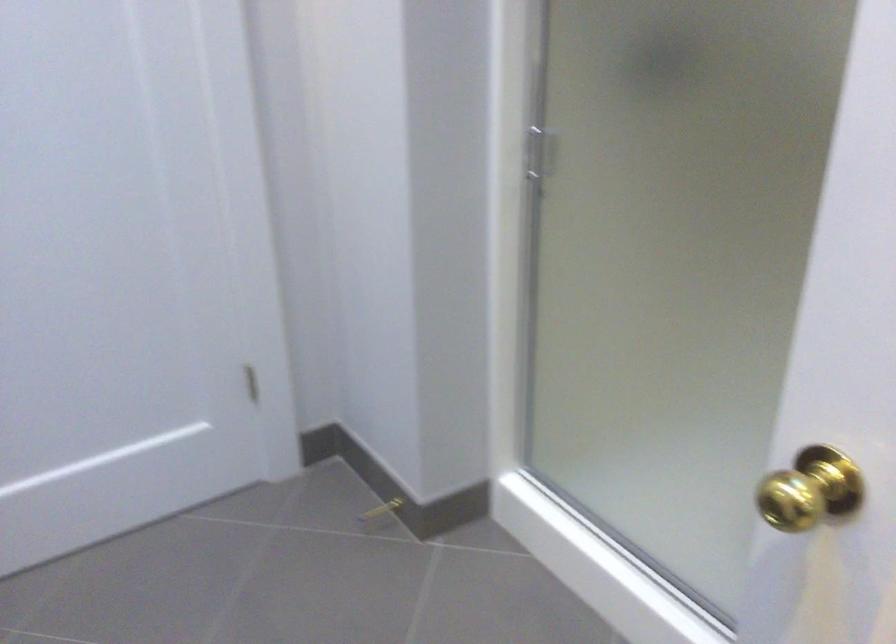
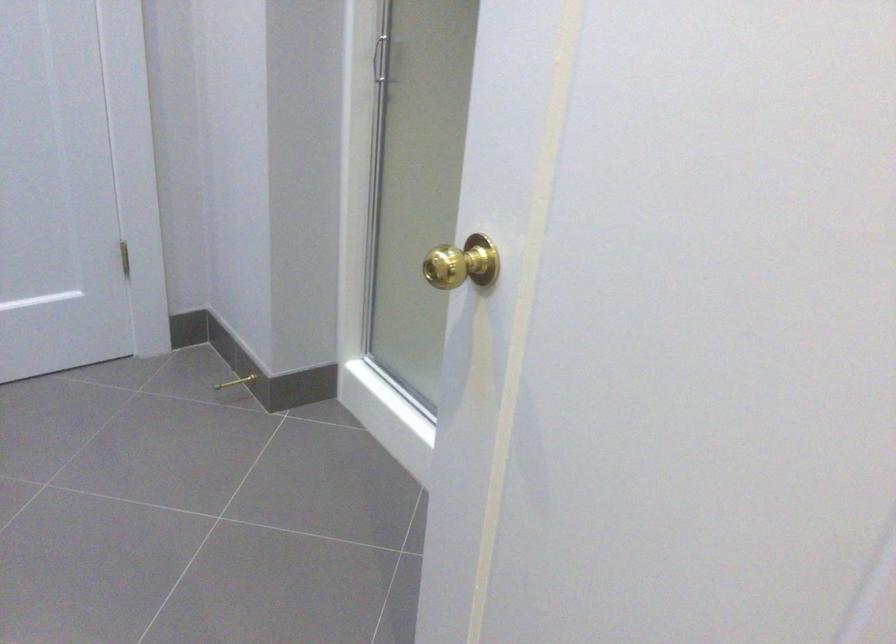
Find the pixel in the second image that matches point (377, 506) in the first image.

(235, 382)